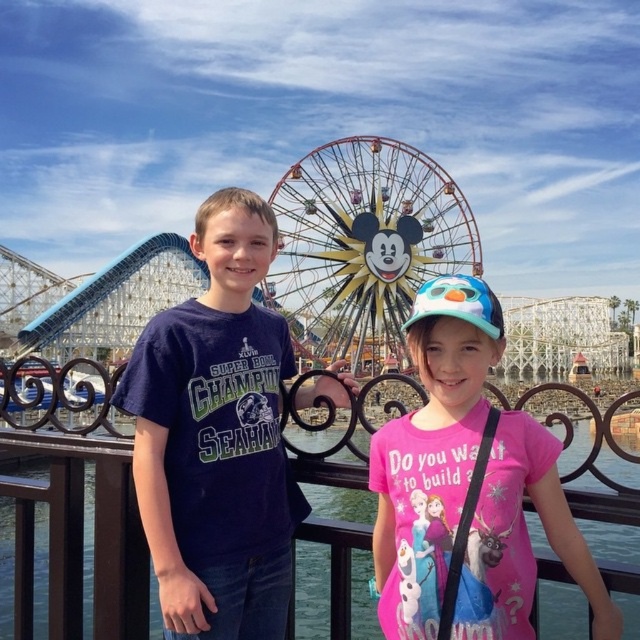
Is pink fabric shirt at center to the left of metallic/reflective ferris wheel at center from the viewer's perspective?

No, pink fabric shirt at center is not to the left of metallic/reflective ferris wheel at center.

Image resolution: width=640 pixels, height=640 pixels. Find the location of `pink fabric shirt at center`. pink fabric shirt at center is located at coordinates (432, 451).

Which is more to the right, matte blue t-shirt at center or metallic/reflective ferris wheel at center?

Positioned to the right is metallic/reflective ferris wheel at center.

Does matte blue t-shirt at center appear on the right side of metallic/reflective ferris wheel at center?

In fact, matte blue t-shirt at center is to the left of metallic/reflective ferris wheel at center.

Measure the distance between point [218,573] and camera.

Point [218,573] is 67.09 meters from camera.

Find the location of `matte blue t-shirt at center`. matte blue t-shirt at center is located at coordinates (216, 436).

Can you confirm if matte blue t-shirt at center is shorter than pink fabric shirt at center?

Incorrect, matte blue t-shirt at center's height does not fall short of pink fabric shirt at center's.

Between point (269, 406) and point (476, 589), which one is positioned in front?

Point (476, 589) is more forward.

Is point (202, 500) behind point (440, 371)?

No, (202, 500) is closer to viewer.

The width and height of the screenshot is (640, 640). What are the coordinates of `matte blue t-shirt at center` in the screenshot? It's located at (216, 436).